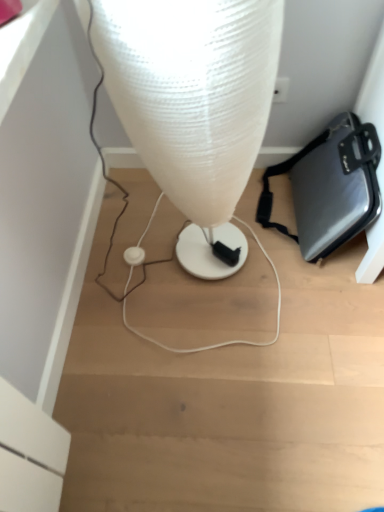
Identify the location of free spot to the right of white plastic earphone at center. Image resolution: width=384 pixels, height=512 pixels. (176, 264).